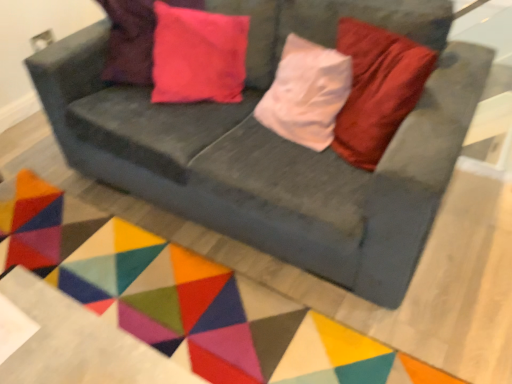
Question: Is velvet gray couch at center not within geometric fabric mat at center?

Choices:
 (A) yes
 (B) no

Answer: (A)

Question: Is the depth of velvet gray couch at center greater than that of geometric fabric mat at center?

Choices:
 (A) no
 (B) yes

Answer: (A)

Question: Does velvet gray couch at center turn towards geometric fabric mat at center?

Choices:
 (A) yes
 (B) no

Answer: (A)

Question: Can you confirm if velvet gray couch at center is smaller than geometric fabric mat at center?

Choices:
 (A) yes
 (B) no

Answer: (B)

Question: Is velvet gray couch at center taller than geometric fabric mat at center?

Choices:
 (A) no
 (B) yes

Answer: (B)

Question: Is pink velvet pillow at upper left in front of or behind velvet gray couch at center in the image?

Choices:
 (A) front
 (B) behind

Answer: (B)

Question: From the image's perspective, relative to velvet gray couch at center, is pink velvet pillow at upper left above or below?

Choices:
 (A) below
 (B) above

Answer: (B)

Question: Visually, is pink velvet pillow at upper left positioned to the left or to the right of velvet gray couch at center?

Choices:
 (A) left
 (B) right

Answer: (A)

Question: In terms of size, does pink velvet pillow at upper left appear bigger or smaller than velvet gray couch at center?

Choices:
 (A) big
 (B) small

Answer: (B)

Question: Is velvet gray couch at center in front of or behind pink velvet pillow at upper left in the image?

Choices:
 (A) behind
 (B) front

Answer: (B)

Question: Considering the positions of velvet gray couch at center and pink velvet pillow at upper left in the image, is velvet gray couch at center taller or shorter than pink velvet pillow at upper left?

Choices:
 (A) short
 (B) tall

Answer: (B)

Question: Do you think velvet gray couch at center is within pink velvet pillow at upper left, or outside of it?

Choices:
 (A) inside
 (B) outside

Answer: (B)

Question: Is point (241, 145) closer or farther from the camera than point (200, 89)?

Choices:
 (A) farther
 (B) closer

Answer: (B)

Question: Is velvet gray couch at center taller or shorter than geometric fabric mat at center?

Choices:
 (A) short
 (B) tall

Answer: (B)

Question: Do you think velvet gray couch at center is within geometric fabric mat at center, or outside of it?

Choices:
 (A) inside
 (B) outside

Answer: (B)